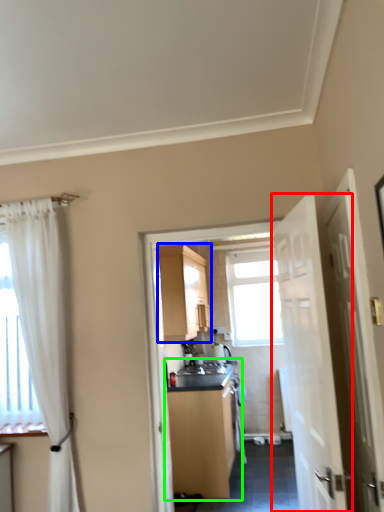
Question: Which object is positioned closest to door (highlighted by a red box)? Select from cabinetry (highlighted by a blue box) and cabinetry (highlighted by a green box).

Choices:
 (A) cabinetry
 (B) cabinetry

Answer: (B)